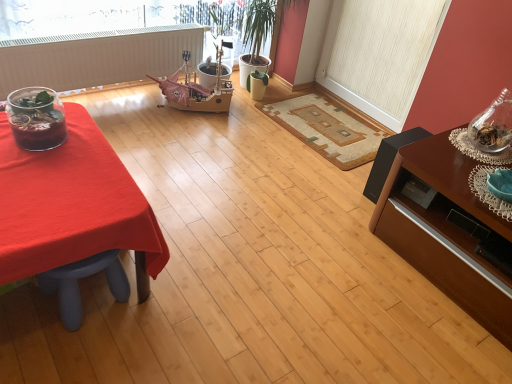
This screenshot has height=384, width=512. What are the coordinates of `free area in between brown wood table at right and smooth red tablecloth at left` in the screenshot? It's located at (284, 268).